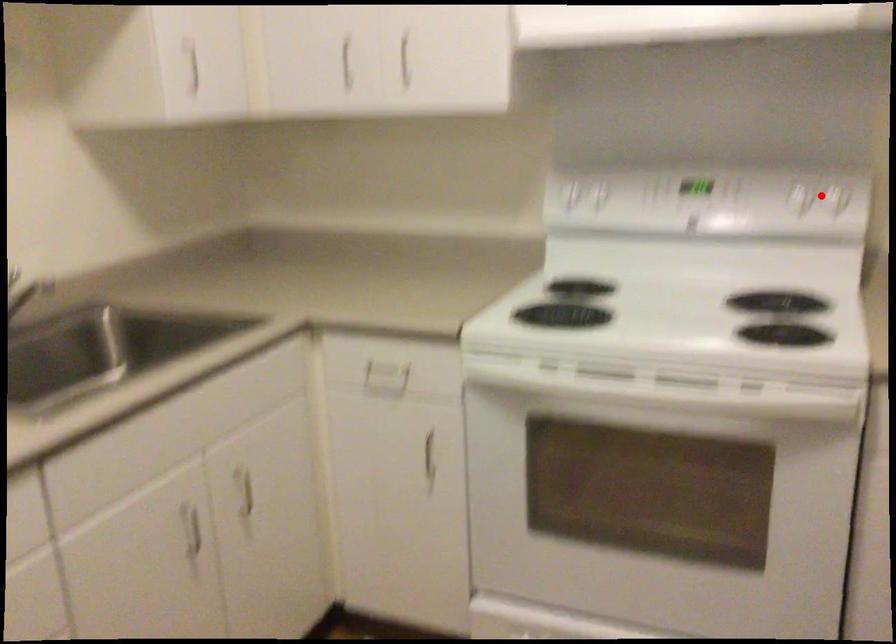
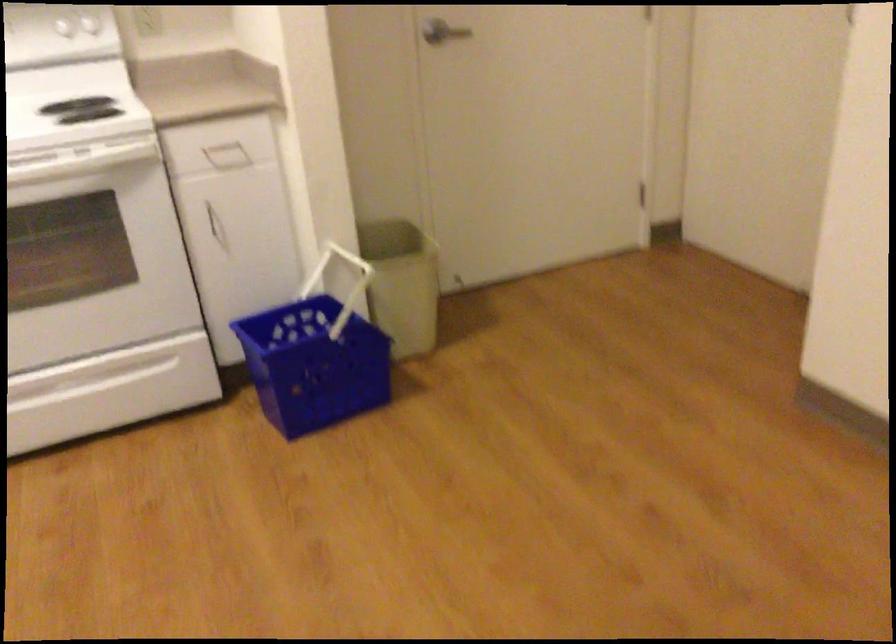
Question: I am providing you with two images of the same scene from different viewpoints. In image1, a red point is highlighted. Considering the same 3D point in image2, which of the following is correct?

Choices:
 (A) It is closer
 (B) It is farther

Answer: (B)